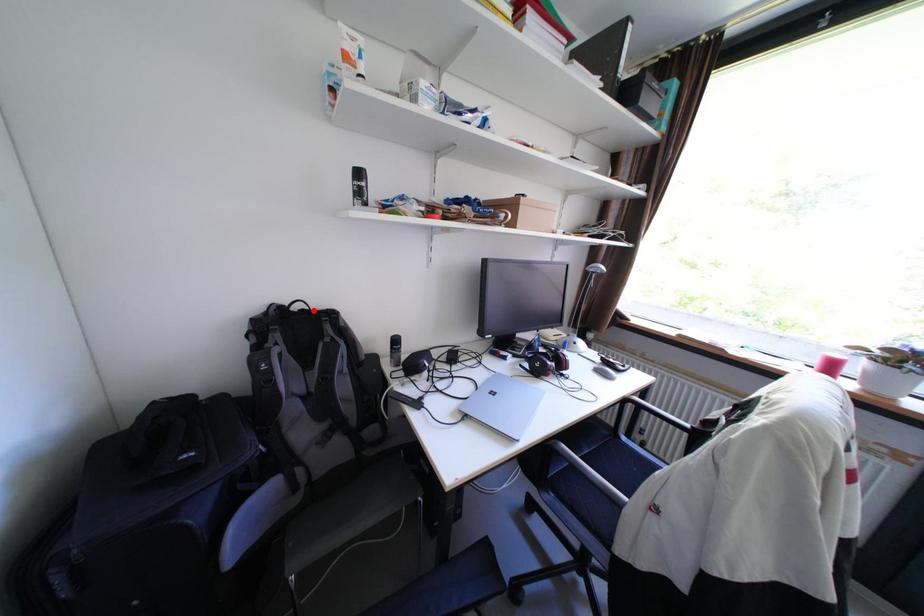
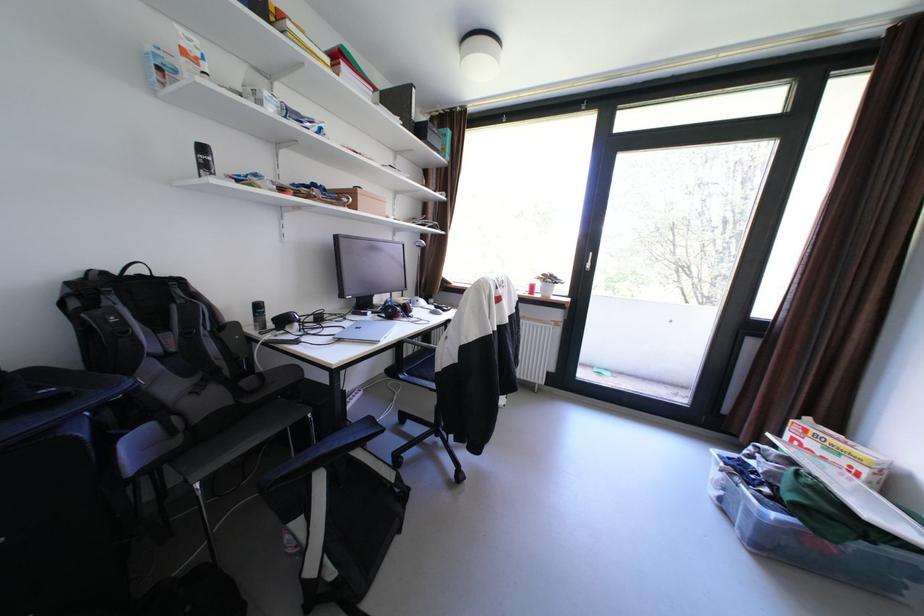
Locate, in the second image, the point that corresponds to the highlighted location in the first image.

(151, 276)